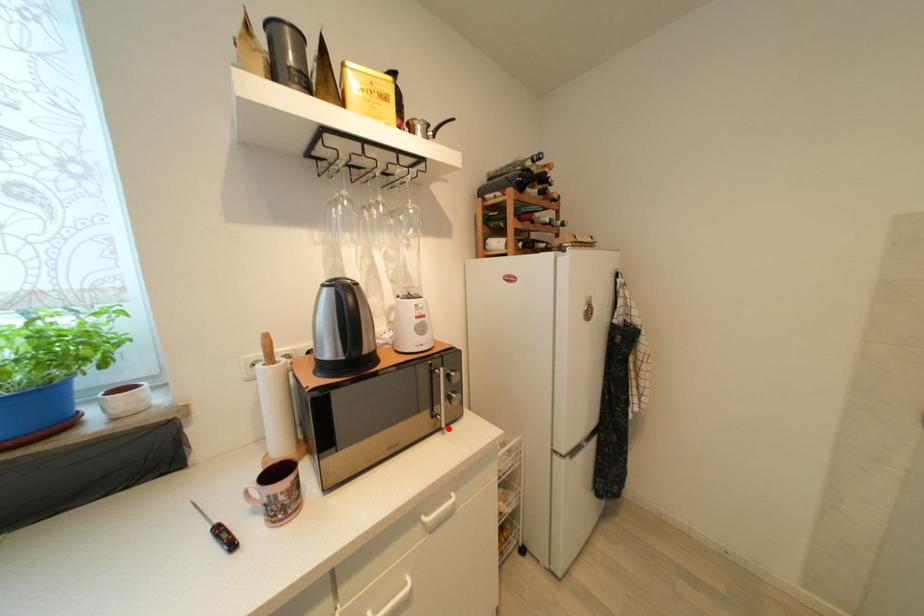
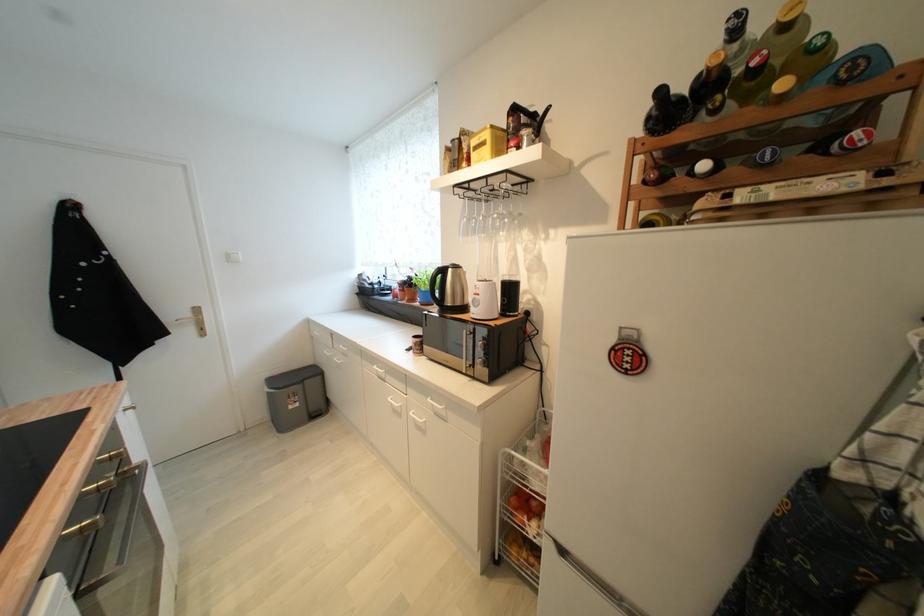
Question: I am providing you with two images of the same scene from different viewpoints. A red point is marked on the first image. At the location where the point appears in image 1, is it still visible in image 2?

Choices:
 (A) Yes
 (B) No

Answer: (A)